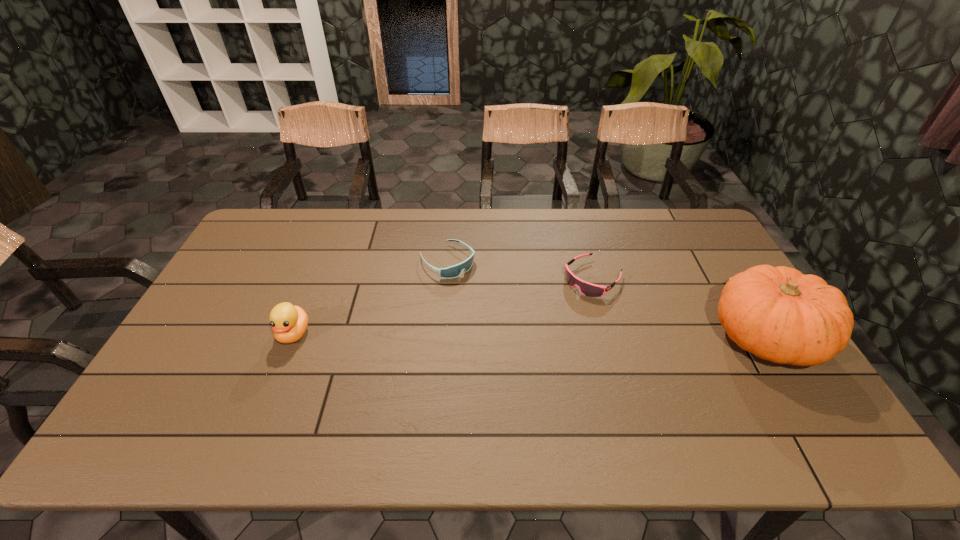
Identify the location of the third shortest object. (289, 323).

The image size is (960, 540). What are the coordinates of `the leftmost object` in the screenshot? It's located at tap(289, 323).

Identify the location of pumpkin. The height and width of the screenshot is (540, 960). (777, 313).

The height and width of the screenshot is (540, 960). Find the location of `the tallest object`. the tallest object is located at coordinates (777, 313).

What are the coordinates of `the third object from right to left` in the screenshot? It's located at (454, 271).

Find the location of `the second object from right to left`. the second object from right to left is located at coordinates (588, 289).

At what (x,y) coordinates should I click in order to perform the action: click on free point located on the face of the third shortest object. Please return your answer as a coordinate pair (x, y). Looking at the image, I should click on (277, 376).

Find the location of `vacant space located on the left of the pumpkin`. vacant space located on the left of the pumpkin is located at coordinates [x=640, y=337].

Where is `vacant space located on the front-facing side of the left goggles`? vacant space located on the front-facing side of the left goggles is located at coordinates (529, 333).

Where is `vacant space situated on the front-facing side of the left goggles`? The image size is (960, 540). vacant space situated on the front-facing side of the left goggles is located at coordinates pyautogui.click(x=529, y=333).